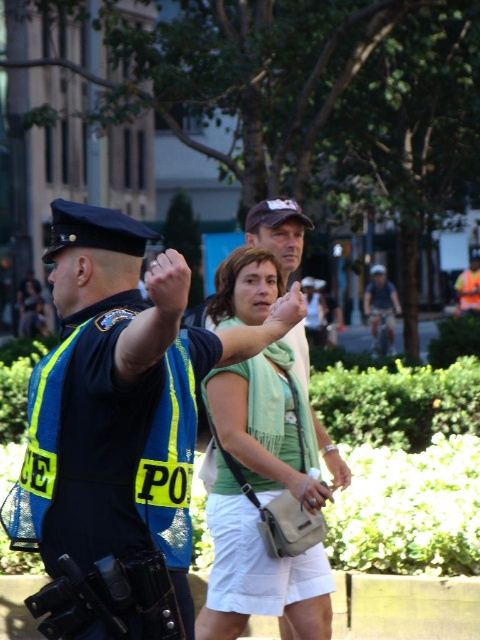
Can you confirm if matte green shirt at center is thinner than green fabric scarf at center?

No, matte green shirt at center is not thinner than green fabric scarf at center.

Between matte green shirt at center and green fabric scarf at center, which one has more height?

Standing taller between the two is green fabric scarf at center.

This screenshot has width=480, height=640. What do you see at coordinates (119, 428) in the screenshot? I see `matte green shirt at center` at bounding box center [119, 428].

I want to click on matte green shirt at center, so click(119, 428).